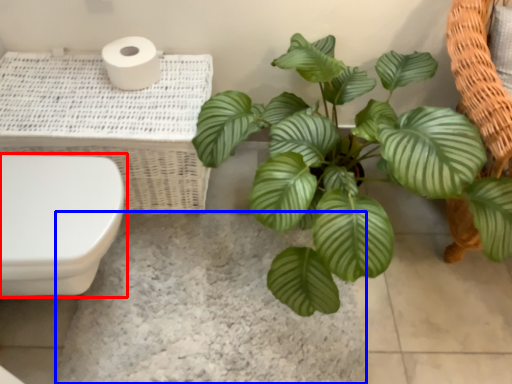
Question: Which point is further to the camera, toilet (highlighted by a red box) or concrete (highlighted by a blue box)?

Choices:
 (A) toilet
 (B) concrete

Answer: (B)